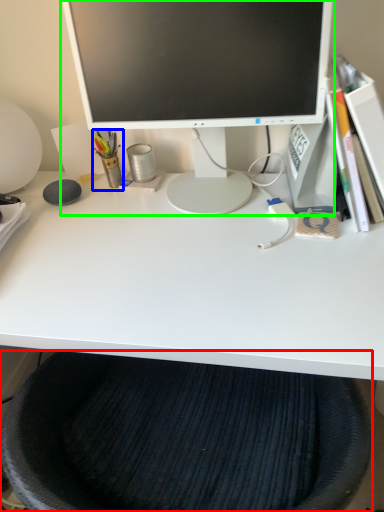
Question: Estimate the real-world distances between objects in this image. Which object is closer to computer chair (highlighted by a red box), stationery (highlighted by a blue box) or computer monitor (highlighted by a green box)?

Choices:
 (A) stationery
 (B) computer monitor

Answer: (B)